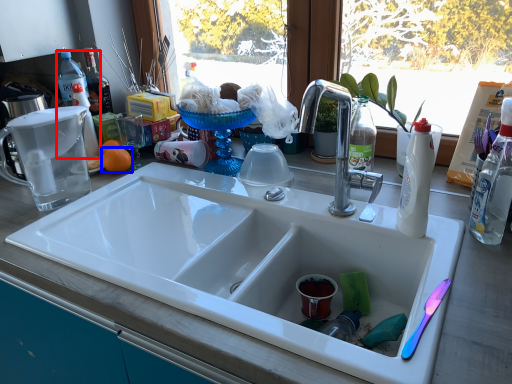
Question: Which object appears closest to the camera in this image, bottle (highlighted by a red box) or orange (highlighted by a blue box)?

Choices:
 (A) bottle
 (B) orange

Answer: (B)